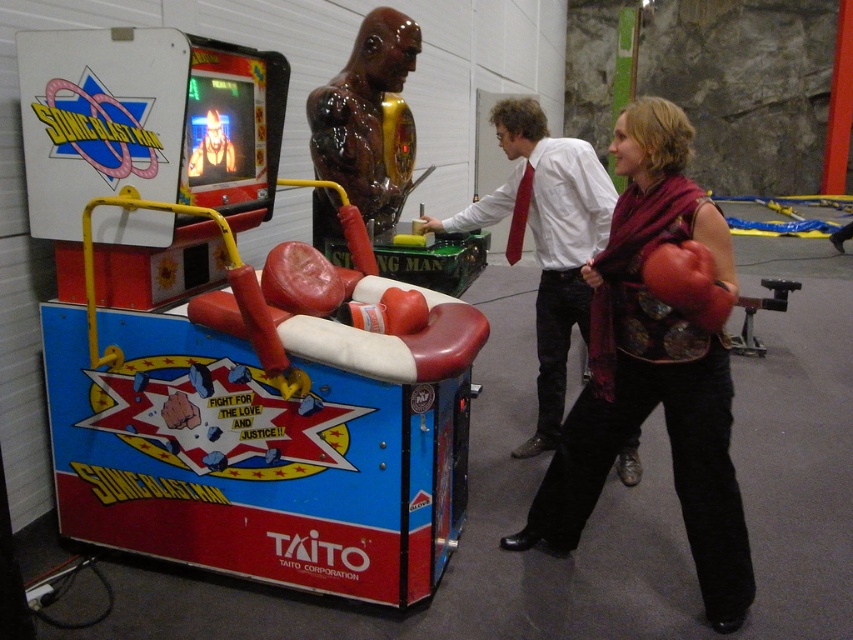
What do you see at coordinates (653, 369) in the screenshot? The width and height of the screenshot is (853, 640). I see `leather boxing glove at center` at bounding box center [653, 369].

Is point (611, 147) farther from camera compared to point (675, 253)?

That is True.

Who is more distant from viewer, (567,513) or (664,256)?

Positioned behind is point (567,513).

Where is `leather boxing glove at center`? The image size is (853, 640). leather boxing glove at center is located at coordinates (653, 369).

Between point (618, 321) and point (380, 186), which one is positioned in front?

Point (618, 321)

Is point (729, 244) positioned before point (360, 58)?

That is True.

Where is `leather boxing glove at center`? The height and width of the screenshot is (640, 853). leather boxing glove at center is located at coordinates (653, 369).

Locate an element on the screen. leather boxing glove at center is located at coordinates (653, 369).

Does leather boxing glove at center appear over white glossy shirt at center?

Actually, leather boxing glove at center is below white glossy shirt at center.

Does point (653, 212) lie behind point (553, 269)?

No.

This screenshot has height=640, width=853. Find the location of `leather boxing glove at center`. leather boxing glove at center is located at coordinates [653, 369].